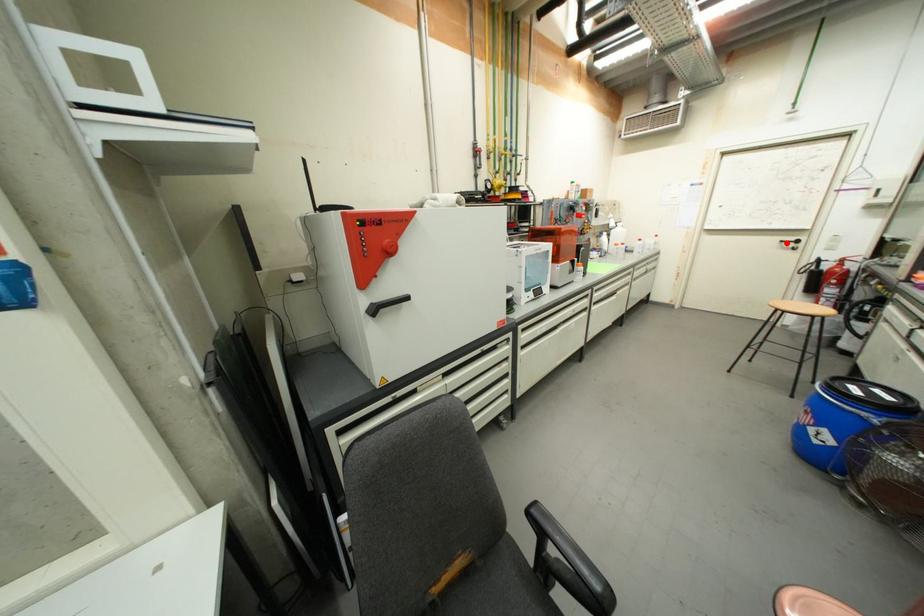
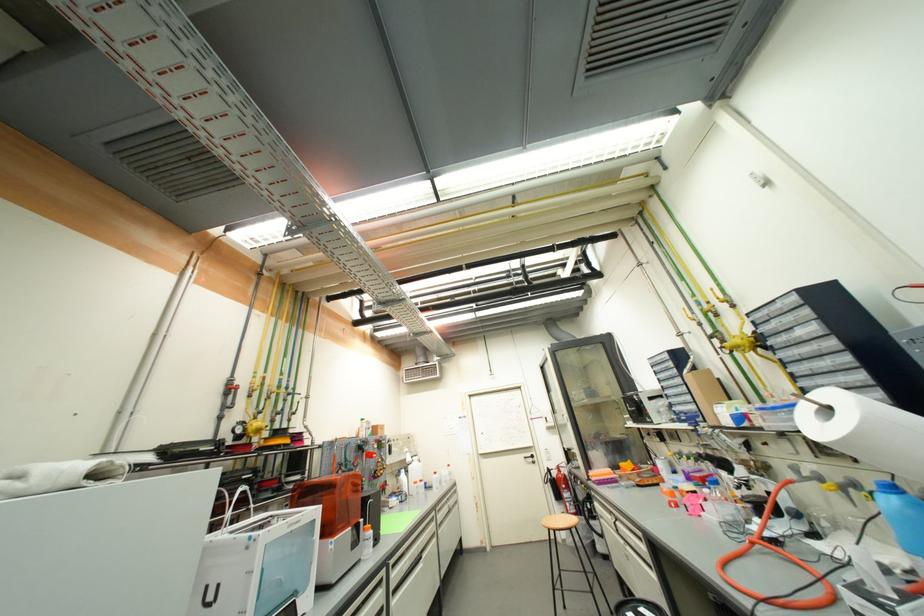
Question: I am providing you with two images of the same scene from different viewpoints. Given a red point in image1, look at the same physical point in image2. Is it:

Choices:
 (A) Closer to the viewpoint
 (B) Farther from the viewpoint

Answer: (B)